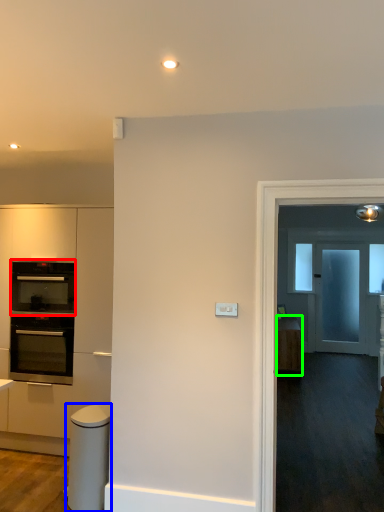
Question: Estimate the real-world distances between objects in this image. Which object is closer to oven (highlighted by a red box), appliance (highlighted by a blue box) or cabinetry (highlighted by a green box)?

Choices:
 (A) appliance
 (B) cabinetry

Answer: (A)